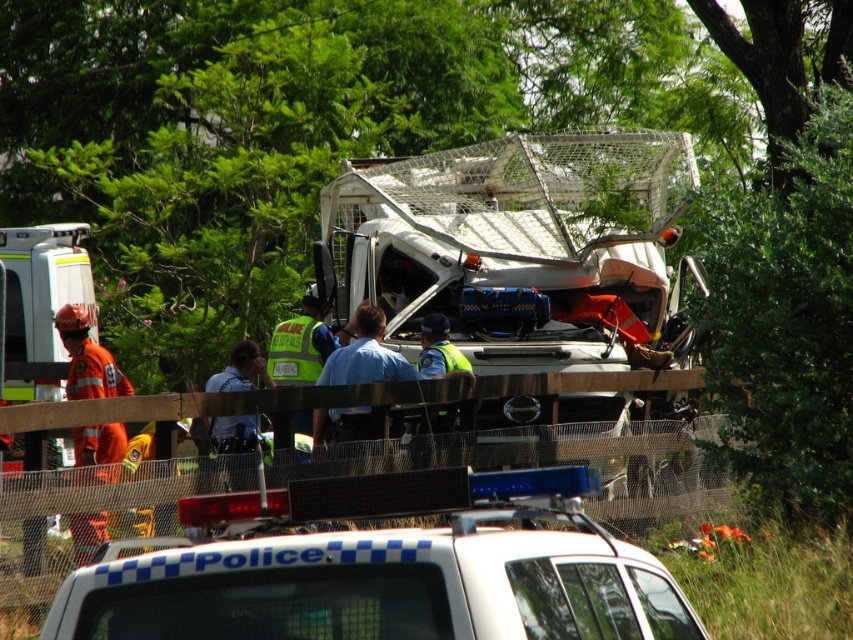
You are an emergency responder assessing the scene. You see an orange reflective uniform at left and a reflective yellow vest at center. Which piece of clothing is taller?

The orange reflective uniform at left is taller than the reflective yellow vest at center.

You are a drone operator tasked with assessing the accident scene. You need to determine if the white plastic police car at center can safely move closer to the orange reflective uniform at left without exceeding a 10 meter distance limit. Can it?

The white plastic police car at center is 9.31 meters away from orange reflective uniform at left. Since the distance is under 10 meters, the police car can move closer without exceeding the limit.